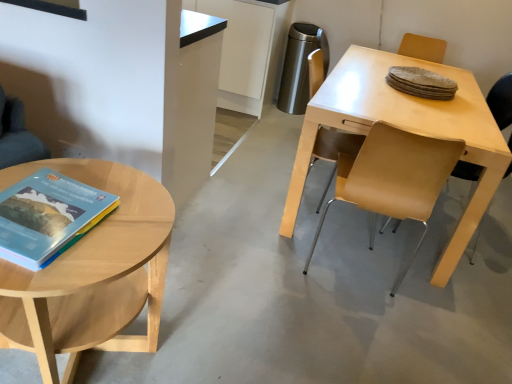
Question: Is light brown leather chair at right, positioned as the 2th chair in left-to-right order, to the left of light wood table at right from the viewer's perspective?

Choices:
 (A) yes
 (B) no

Answer: (B)

Question: Considering the relative sizes of light brown leather chair at right, positioned as the 2th chair in left-to-right order, and light wood table at right in the image provided, is light brown leather chair at right, positioned as the 2th chair in left-to-right order, taller than light wood table at right?

Choices:
 (A) yes
 (B) no

Answer: (A)

Question: Is light wood table at right completely or partially inside light brown leather chair at right, which appears as the first chair when viewed from the right?

Choices:
 (A) yes
 (B) no

Answer: (B)

Question: Is light brown leather chair at right, positioned as the 2th chair in left-to-right order, next to light wood table at right?

Choices:
 (A) yes
 (B) no

Answer: (B)

Question: Can you confirm if light brown leather chair at right, which appears as the first chair when viewed from the right, is smaller than light wood table at right?

Choices:
 (A) yes
 (B) no

Answer: (A)

Question: In terms of size, does light brown wood coffee table at left appear bigger or smaller than light brown leather chair at right, positioned as the 2th chair in left-to-right order?

Choices:
 (A) small
 (B) big

Answer: (B)

Question: Considering the relative positions of light brown wood coffee table at left and light brown leather chair at right, which appears as the first chair when viewed from the right, in the image provided, is light brown wood coffee table at left to the left or to the right of light brown leather chair at right, which appears as the first chair when viewed from the right,?

Choices:
 (A) left
 (B) right

Answer: (A)

Question: From the image's perspective, is light brown wood coffee table at left above or below light brown leather chair at right, which appears as the first chair when viewed from the right?

Choices:
 (A) below
 (B) above

Answer: (A)

Question: Considering their positions, is light brown wood coffee table at left located in front of or behind light brown leather chair at right, positioned as the 2th chair in left-to-right order?

Choices:
 (A) behind
 (B) front

Answer: (B)

Question: Looking at the image, does light wood table at right seem bigger or smaller compared to light brown leather chair at right, which appears as the first chair when viewed from the right?

Choices:
 (A) small
 (B) big

Answer: (B)

Question: From a real-world perspective, is light wood table at right physically located above or below light brown leather chair at right, positioned as the 2th chair in left-to-right order?

Choices:
 (A) below
 (B) above

Answer: (A)

Question: Would you say light wood table at right is to the left or to the right of light brown leather chair at right, which appears as the first chair when viewed from the right, in the picture?

Choices:
 (A) right
 (B) left

Answer: (B)

Question: From their relative heights in the image, would you say light wood table at right is taller or shorter than light brown leather chair at right, which appears as the first chair when viewed from the right?

Choices:
 (A) tall
 (B) short

Answer: (B)

Question: From the image's perspective, is light brown wood coffee table at left positioned above or below matte hardcover book at left?

Choices:
 (A) below
 (B) above

Answer: (A)

Question: From their relative heights in the image, would you say light brown wood coffee table at left is taller or shorter than matte hardcover book at left?

Choices:
 (A) tall
 (B) short

Answer: (A)